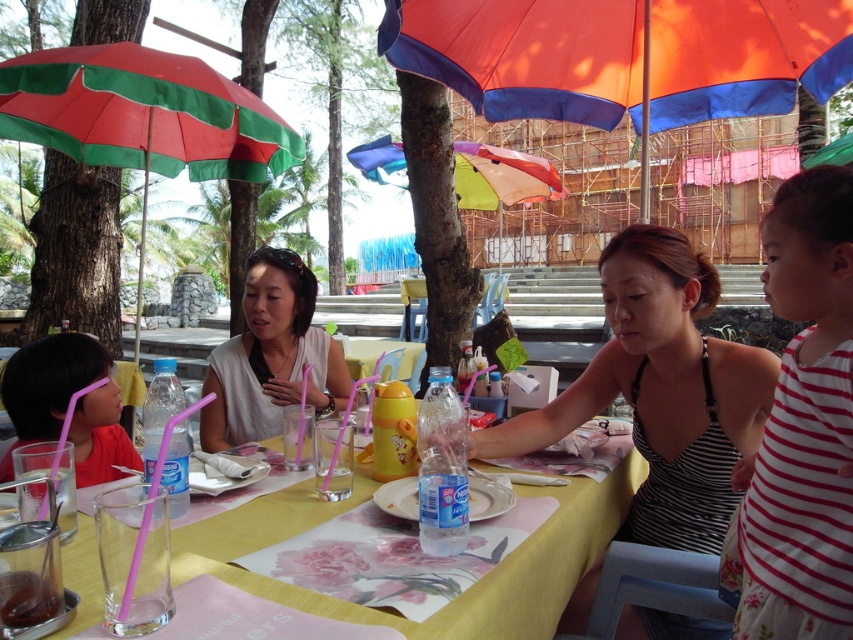
Question: Which point is closer to the camera taking this photo?

Choices:
 (A) (222, 346)
 (B) (460, 612)
 (C) (36, 83)
 (D) (682, 486)

Answer: (B)

Question: Where is striped fabric dress at center located in relation to clear glass water at table center in the image?

Choices:
 (A) left
 (B) right

Answer: (B)

Question: Estimate the real-world distances between objects in this image. Which object is closer to the clear plastic bottle at table center?

Choices:
 (A) striped fabric dress at center
 (B) smooth black hair at left
 (C) clear glass water at table center

Answer: (C)

Question: Is orange fabric umbrella at center in front of yellow fabric table at center?

Choices:
 (A) no
 (B) yes

Answer: (A)

Question: Can you confirm if green striped umbrella at left is positioned to the left of clear plastic bottle at table center?

Choices:
 (A) yes
 (B) no

Answer: (A)

Question: Which object appears closest to the camera in this image?

Choices:
 (A) smooth black hair at left
 (B) clear glass water at table center
 (C) yellow fabric table at center
 (D) striped fabric dress at center

Answer: (C)